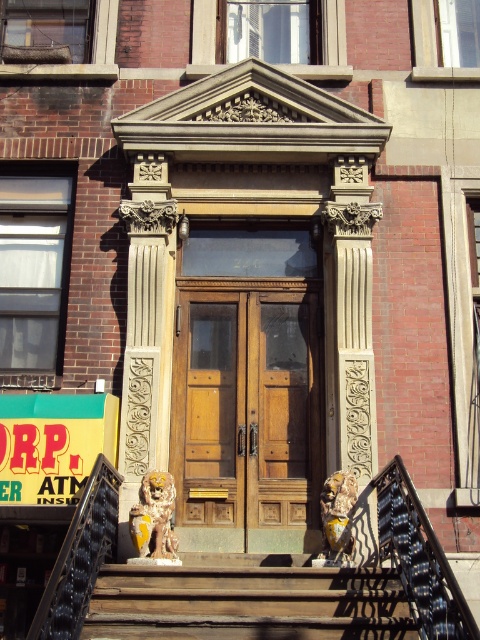
You are a delivery person trying to enter the building. The wooden door at center and wooden stairs at center are both in front of you. Which one should you approach first to enter the building?

The wooden door at center is bigger than wooden stairs at center, so you should approach the wooden door at center first to enter the building.